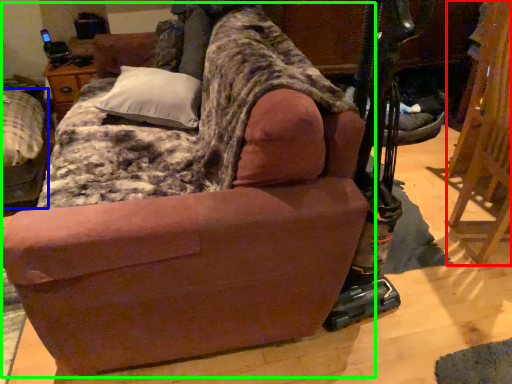
Question: Which is nearer to the folding chair (highlighted by a red box)? furniture (highlighted by a blue box) or studio couch (highlighted by a green box).

Choices:
 (A) furniture
 (B) studio couch

Answer: (B)